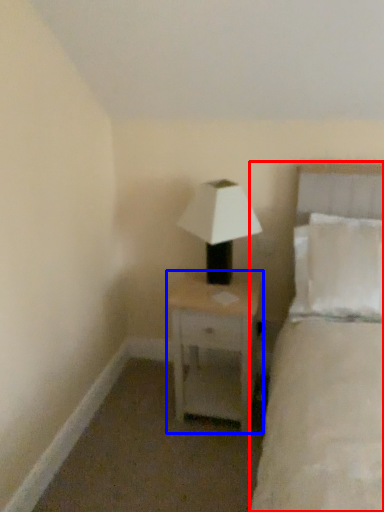
Question: Which of the following is the closest to the observer, bed (highlighted by a red box) or nightstand (highlighted by a blue box)?

Choices:
 (A) bed
 (B) nightstand

Answer: (A)